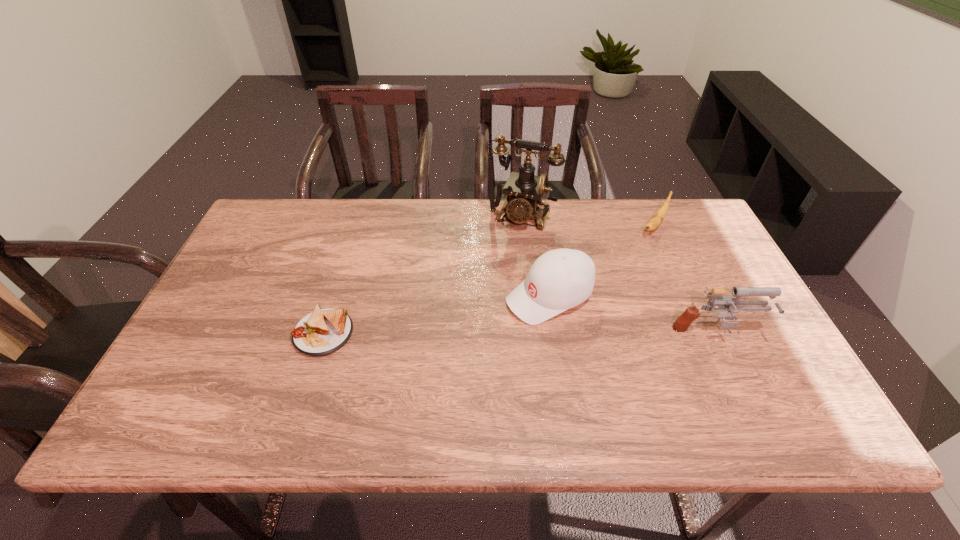
Locate an element on the screen. The width and height of the screenshot is (960, 540). object that is at the far right corner is located at coordinates (656, 220).

In the image, there is a desktop. Find the location of `vacant space at the far edge`. vacant space at the far edge is located at coordinates (601, 204).

Find the location of a particular element. The height and width of the screenshot is (540, 960). free region at the left edge is located at coordinates (194, 340).

In the image, there is a desktop. Identify the location of vacant space at the far left corner. This screenshot has height=540, width=960. [x=277, y=234].

Where is `vacant region at the far right corner of the desktop`? vacant region at the far right corner of the desktop is located at coordinates (697, 226).

At what (x,y) coordinates should I click in order to perform the action: click on vacant area at the near right corner. Please return your answer as a coordinate pair (x, y). Looking at the image, I should click on (754, 366).

The width and height of the screenshot is (960, 540). Identify the location of unoccupied area between the second shortest object and the telephone. (588, 221).

In order to click on free space between the telephone and the leftmost object in this screenshot , I will do point(422,275).

Image resolution: width=960 pixels, height=540 pixels. Find the location of `vacant space that is in between the tallest object and the gun`. vacant space that is in between the tallest object and the gun is located at coordinates (618, 275).

This screenshot has height=540, width=960. Identify the location of free space that is in between the baseball cap and the tallest object. (535, 256).